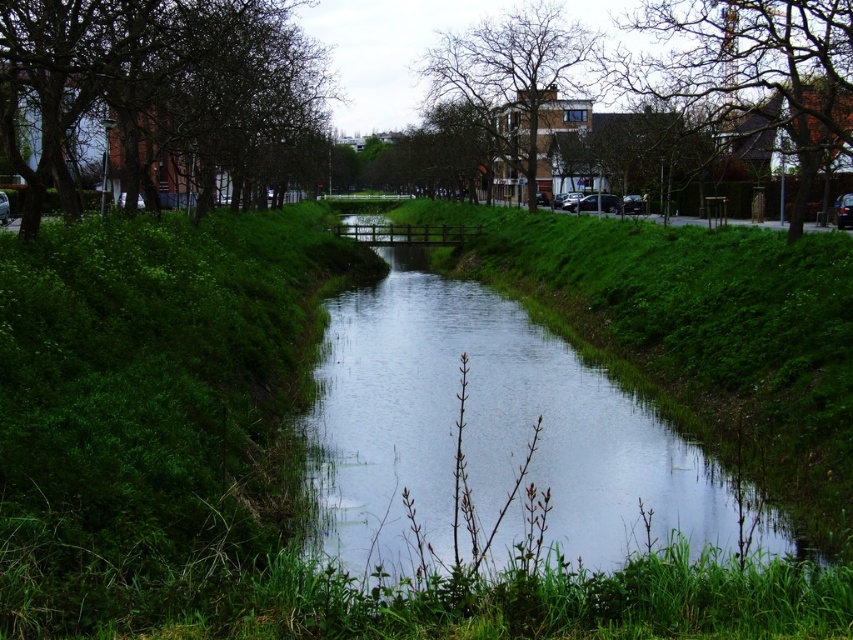
Question: Which point is farther to the camera?

Choices:
 (A) (827, 74)
 (B) (39, 102)
 (C) (498, 74)

Answer: (C)

Question: Considering the real-world distances, which object is farthest from the dark brown textured tree at left?

Choices:
 (A) bare branches at upper center
 (B) bare branches at upper right

Answer: (B)

Question: Which of the following is the farthest from the observer?

Choices:
 (A) bare branches at upper center
 (B) bare branches at upper right
 (C) dark brown textured tree at left

Answer: (A)

Question: Can you confirm if dark brown textured tree at left is thinner than bare branches at upper center?

Choices:
 (A) yes
 (B) no

Answer: (A)

Question: Can you confirm if dark brown textured tree at left is positioned to the right of bare branches at upper right?

Choices:
 (A) yes
 (B) no

Answer: (B)

Question: Does bare branches at upper right appear over bare branches at upper center?

Choices:
 (A) no
 (B) yes

Answer: (A)